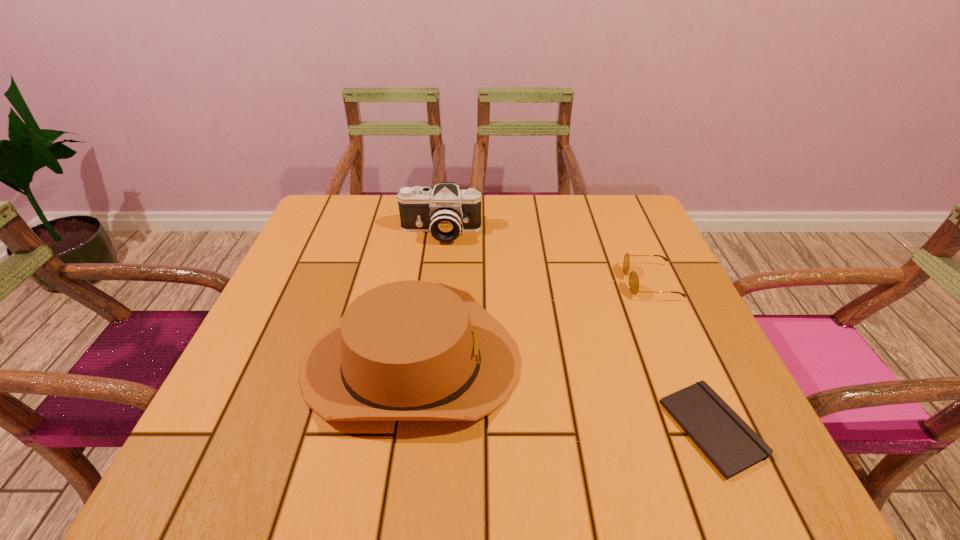
This screenshot has height=540, width=960. Identify the location of vacant point located between the third tallest object and the camera. (545, 257).

You are a GUI agent. You are given a task and a screenshot of the screen. Output one action in this format:
    pyautogui.click(x=<x>, y=<y>)
    Task: Click on the vacant space that's between the farthest object and the third nearest object
    
    Given the screenshot: What is the action you would take?
    pyautogui.click(x=545, y=257)

What are the coordinates of `free spot between the checkbook and the cowboy hat` in the screenshot? It's located at (562, 395).

Where is `free space that is in between the camera and the shortest object`? free space that is in between the camera and the shortest object is located at coordinates (576, 330).

At what (x,y) coordinates should I click in order to perform the action: click on vacant area that lies between the sunglasses and the third shortest object. Please return your answer as a coordinate pair (x, y). The height and width of the screenshot is (540, 960). Looking at the image, I should click on [531, 322].

Identify which object is located as the second nearest to the shortest object. Please provide its 2D coordinates. Your answer should be formatted as a tuple, i.e. [(x, y)], where the tuple contains the x and y coordinates of a point satisfying the conditions above.

[(411, 350)]

Locate an element on the screen. The height and width of the screenshot is (540, 960). object that is the third nearest to the shortest object is located at coordinates (446, 212).

The width and height of the screenshot is (960, 540). I want to click on free space that satisfies the following two spatial constraints: 1. on the front-facing side of the third shortest object; 2. on the left side of the checkbook, so click(x=402, y=429).